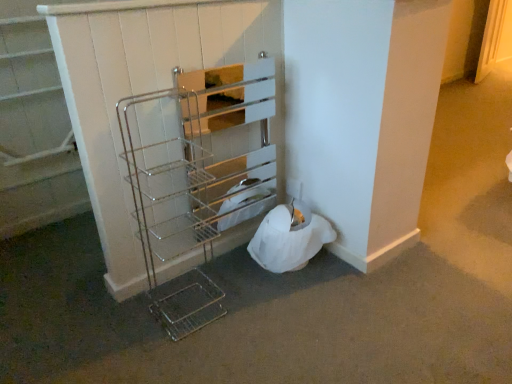
Question: Is metallic wire shelf at upper left, arranged as the 1th shelf when viewed from the left, behind chrome/metallic wire rack at center, which is the 1th shelf in right-to-left order?

Choices:
 (A) no
 (B) yes

Answer: (B)

Question: From a real-world perspective, does metallic wire shelf at upper left, positioned as the second shelf in right-to-left order, sit lower than chrome/metallic wire rack at center, which is the 1th shelf in right-to-left order?

Choices:
 (A) yes
 (B) no

Answer: (B)

Question: Does metallic wire shelf at upper left, arranged as the 1th shelf when viewed from the left, have a greater height compared to chrome/metallic wire rack at center, which is counted as the 2th shelf, starting from the left?

Choices:
 (A) yes
 (B) no

Answer: (B)

Question: From the image's perspective, is metallic wire shelf at upper left, arranged as the 1th shelf when viewed from the left, located beneath chrome/metallic wire rack at center, which is the 1th shelf in right-to-left order?

Choices:
 (A) yes
 (B) no

Answer: (B)

Question: Are metallic wire shelf at upper left, arranged as the 1th shelf when viewed from the left, and chrome/metallic wire rack at center, which is counted as the 2th shelf, starting from the left, located far from each other?

Choices:
 (A) no
 (B) yes

Answer: (A)

Question: Can you confirm if metallic wire shelf at upper left, arranged as the 1th shelf when viewed from the left, is bigger than chrome/metallic wire rack at center, which is counted as the 2th shelf, starting from the left?

Choices:
 (A) yes
 (B) no

Answer: (B)

Question: From a real-world perspective, is chrome/metallic wire rack at center, which is the 1th shelf in right-to-left order, under metallic wire shelf at upper left, positioned as the second shelf in right-to-left order?

Choices:
 (A) no
 (B) yes

Answer: (B)

Question: Does chrome/metallic wire rack at center, which is the 1th shelf in right-to-left order, contain metallic wire shelf at upper left, arranged as the 1th shelf when viewed from the left?

Choices:
 (A) yes
 (B) no

Answer: (B)

Question: Is chrome/metallic wire rack at center, which is counted as the 2th shelf, starting from the left, aimed at metallic wire shelf at upper left, positioned as the second shelf in right-to-left order?

Choices:
 (A) no
 (B) yes

Answer: (A)

Question: From the image's perspective, is chrome/metallic wire rack at center, which is the 1th shelf in right-to-left order, on top of metallic wire shelf at upper left, positioned as the second shelf in right-to-left order?

Choices:
 (A) yes
 (B) no

Answer: (B)

Question: Is chrome/metallic wire rack at center, which is counted as the 2th shelf, starting from the left, at the right side of metallic wire shelf at upper left, arranged as the 1th shelf when viewed from the left?

Choices:
 (A) no
 (B) yes

Answer: (B)

Question: Can you confirm if chrome/metallic wire rack at center, which is counted as the 2th shelf, starting from the left, is thinner than metallic wire shelf at upper left, arranged as the 1th shelf when viewed from the left?

Choices:
 (A) no
 (B) yes

Answer: (A)

Question: From a real-world perspective, is chrome/metallic wire rack at center, which is the 1th shelf in right-to-left order, physically located above or below metallic wire shelf at upper left, positioned as the second shelf in right-to-left order?

Choices:
 (A) below
 (B) above

Answer: (A)